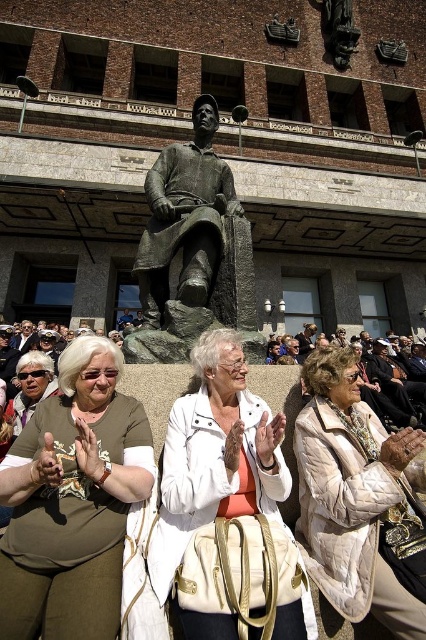
Question: Can you confirm if matte olive green blouse at center is positioned to the left of matte brown jacket at lower left?

Choices:
 (A) yes
 (B) no

Answer: (B)

Question: Which point is farther to the camera?

Choices:
 (A) (71, 625)
 (B) (141, 240)

Answer: (B)

Question: Estimate the real-world distances between objects in this image. Which object is closer to the matte brown jacket at lower left?

Choices:
 (A) matte olive green blouse at center
 (B) beige quilted coat at center

Answer: (A)

Question: Can you confirm if beige quilted coat at center is wider than bronze statue at center?

Choices:
 (A) yes
 (B) no

Answer: (B)

Question: Which object is the closest to the matte brown jacket at lower left?

Choices:
 (A) matte olive green blouse at center
 (B) white leather bag at center
 (C) bronze statue at center

Answer: (A)

Question: Is beige quilted coat at center bigger than bronze statue at center?

Choices:
 (A) yes
 (B) no

Answer: (B)